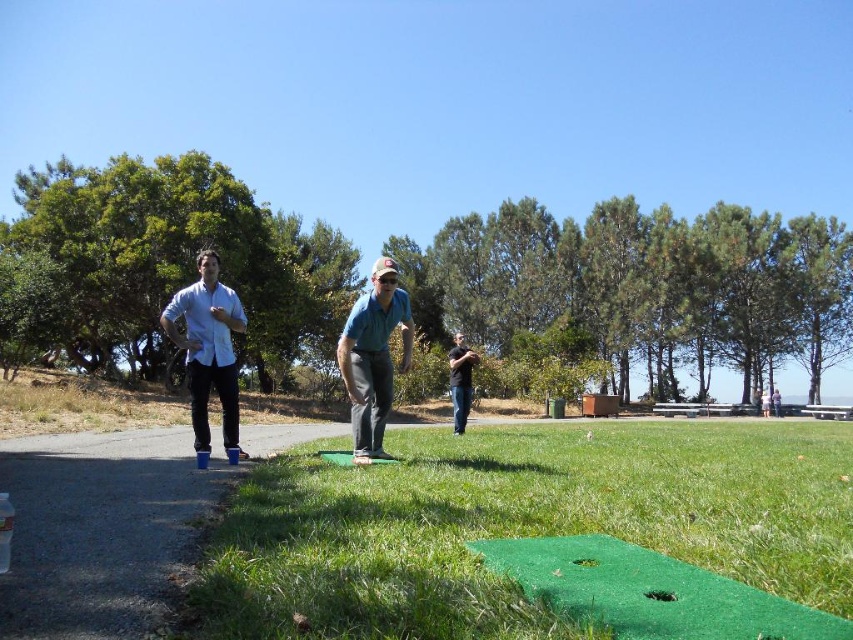
You are playing mini golf and need to place your ball on the green artificial turf at center. The game requires the ball to be placed exactly at point [519,525]. Can you confirm if the green artificial turf at center is positioned correctly at that coordinate?

The green artificial turf at center is located at point [519,525], so yes, it is positioned correctly at that coordinate.

You are a photographer trying to capture both the white matte shirt at center and the green fabric cap at center in a single shot. Since the camera can only focus on one subject at a time, which subject should you focus on to ensure the other remains in the background?

You should focus on the white matte shirt at center because it is closer to the viewer than the green fabric cap at center, so focusing on it will keep the green fabric cap at center in the background.

You are playing mini golf and need to hit the ball from the green artificial turf mat towards the hole. There are two points marked on the mat at coordinates point (x=212, y=337) and point (x=383, y=372). Which point is closer to the hole?

Point (x=212, y=337) is closer to the camera than point (x=383, y=372), so it is closer to the hole.